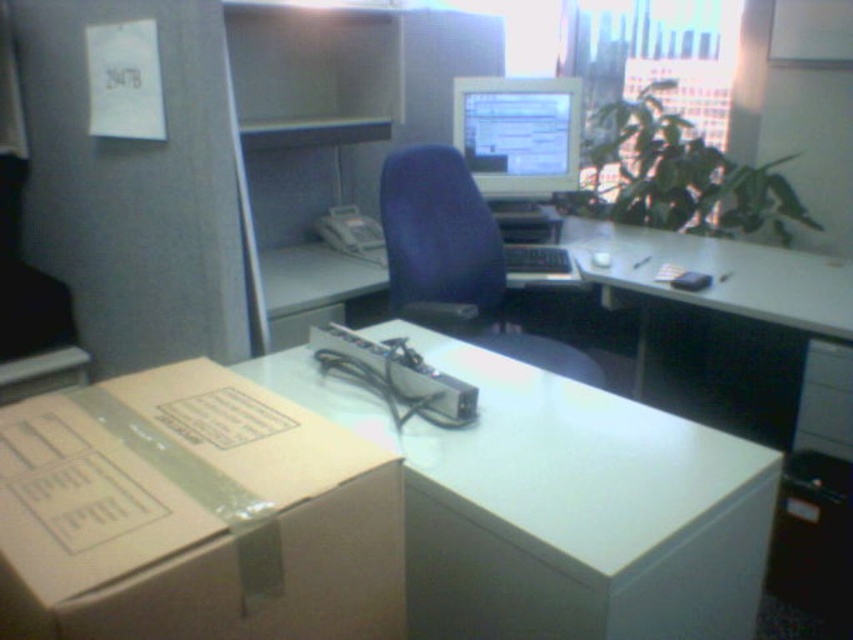
Who is more forward, (425, 218) or (576, 115)?

Point (425, 218) is more forward.

Where is `matte blue swivel chair at center`? The width and height of the screenshot is (853, 640). matte blue swivel chair at center is located at coordinates [x=456, y=260].

Where is `matte blue swivel chair at center`? matte blue swivel chair at center is located at coordinates (456, 260).

Which is behind, point (323, 512) or point (547, 161)?

Positioned behind is point (547, 161).

Who is taller, brown cardboard box at lower left or matte gray monitor at center?

With more height is matte gray monitor at center.

Between point (225, 476) and point (492, 179), which one is positioned in front?

Point (225, 476) is in front.

Where is `brown cardboard box at lower left`? This screenshot has width=853, height=640. brown cardboard box at lower left is located at coordinates (193, 515).

Does point (186, 628) come behind point (502, 525)?

No, it is in front of (502, 525).

Locate an element on the screen. The width and height of the screenshot is (853, 640). brown cardboard box at lower left is located at coordinates (193, 515).